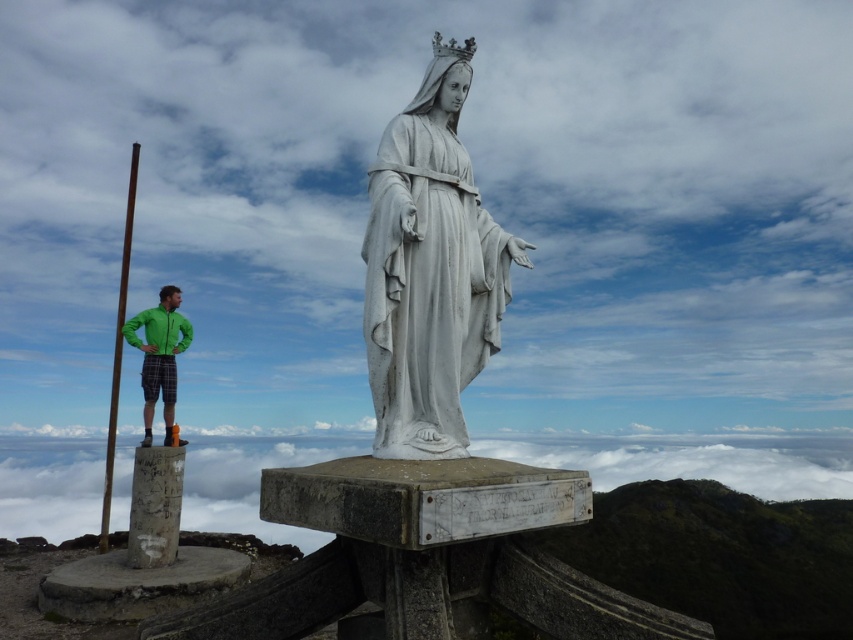
Can you confirm if green fabric jacket at center is positioned to the right of smooth brown wooden pole at left?

Yes, green fabric jacket at center is to the right of smooth brown wooden pole at left.

Does green fabric jacket at center have a greater height compared to smooth brown wooden pole at left?

Incorrect, green fabric jacket at center's height is not larger of smooth brown wooden pole at left's.

Which is behind, point (171, 355) or point (105, 456)?

The point (105, 456) is more distant.

Image resolution: width=853 pixels, height=640 pixels. I want to click on green fabric jacket at center, so coord(160,355).

Does white marble statue at center come behind smooth brown wooden pole at left?

No.

Is point (412, 228) less distant than point (126, 288)?

Yes, point (412, 228) is in front of point (126, 288).

Is point (393, 451) more distant than point (134, 147)?

No, (393, 451) is in front of (134, 147).

Where is `white marble statue at center`? white marble statue at center is located at coordinates (430, 269).

Does white marble statue at center have a larger size compared to green fabric jacket at center?

Indeed, white marble statue at center has a larger size compared to green fabric jacket at center.

Between point (395, 442) and point (148, 314), which one is positioned in front?

Point (395, 442) is more forward.

Who is more distant from viewer, (387,449) or (170,419)?

The point (170,419) is behind.

Find the location of a particular element. This screenshot has height=640, width=853. white marble statue at center is located at coordinates (430, 269).